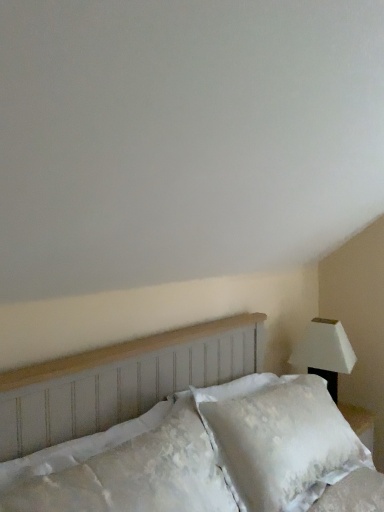
Question: Considering the relative sizes of white matte lamp at right and white textured pillow at lower left in the image provided, is white matte lamp at right thinner than white textured pillow at lower left?

Choices:
 (A) yes
 (B) no

Answer: (B)

Question: Does white matte lamp at right come in front of white textured pillow at lower left?

Choices:
 (A) yes
 (B) no

Answer: (B)

Question: Is white textured pillow at lower left at the back of white matte lamp at right?

Choices:
 (A) yes
 (B) no

Answer: (B)

Question: Would you say white matte lamp at right contains white textured pillow at lower left?

Choices:
 (A) no
 (B) yes

Answer: (A)

Question: Can we say white matte lamp at right lies outside white textured pillow at lower left?

Choices:
 (A) yes
 (B) no

Answer: (A)

Question: Is white textured headboard at center in front of or behind white textured pillow at lower left in the image?

Choices:
 (A) front
 (B) behind

Answer: (A)

Question: Choose the correct answer: Is white textured headboard at center inside white textured pillow at lower left or outside it?

Choices:
 (A) inside
 (B) outside

Answer: (B)

Question: Looking at their shapes, would you say white textured headboard at center is wider or thinner than white textured pillow at lower left?

Choices:
 (A) wide
 (B) thin

Answer: (A)

Question: Is point [x=107, y=509] closer or farther from the camera than point [x=132, y=502]?

Choices:
 (A) farther
 (B) closer

Answer: (B)

Question: Considering the positions of point (163, 439) and point (337, 325), is point (163, 439) closer or farther from the camera than point (337, 325)?

Choices:
 (A) closer
 (B) farther

Answer: (A)

Question: Is white textured pillow at lower left situated inside white matte lamp at right or outside?

Choices:
 (A) inside
 (B) outside

Answer: (B)

Question: From a real-world perspective, is white textured pillow at lower left physically located above or below white matte lamp at right?

Choices:
 (A) below
 (B) above

Answer: (B)

Question: Is white textured pillow at lower left wider or thinner than white matte lamp at right?

Choices:
 (A) wide
 (B) thin

Answer: (B)

Question: Considering the positions of white textured pillow at lower left and white textured headboard at center in the image, is white textured pillow at lower left taller or shorter than white textured headboard at center?

Choices:
 (A) tall
 (B) short

Answer: (B)

Question: From a real-world perspective, is white textured pillow at lower left above or below white textured headboard at center?

Choices:
 (A) below
 (B) above

Answer: (B)